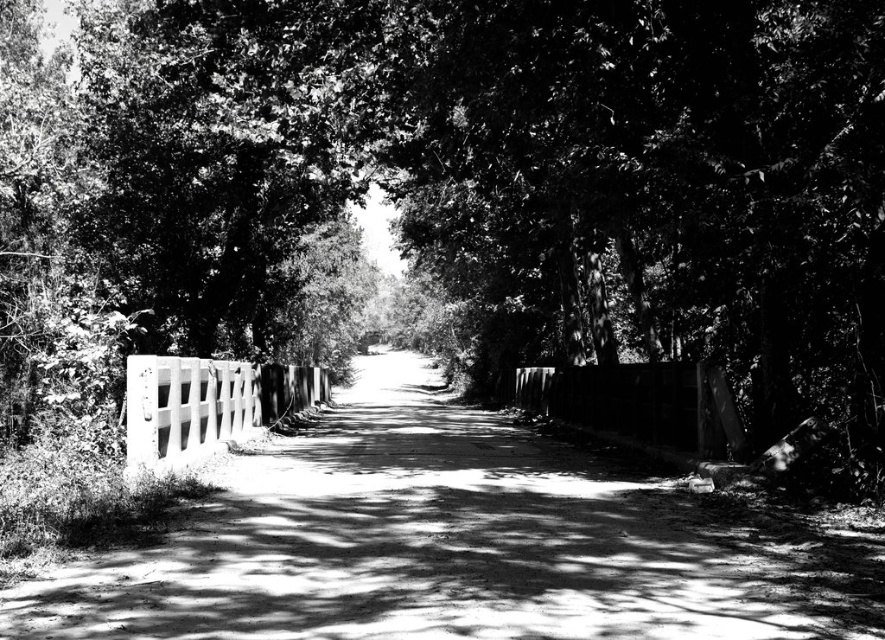
Does smooth concrete fence at left have a lesser width compared to smooth wooden fence at center?

No, smooth concrete fence at left is not thinner than smooth wooden fence at center.

Does smooth concrete fence at left appear on the left side of smooth wooden fence at center?

Indeed, smooth concrete fence at left is positioned on the left side of smooth wooden fence at center.

Image resolution: width=885 pixels, height=640 pixels. Describe the element at coordinates (206, 404) in the screenshot. I see `smooth concrete fence at left` at that location.

The image size is (885, 640). Identify the location of smooth concrete fence at left. (206, 404).

Which is in front, point (37, 595) or point (608, 426)?

Positioned in front is point (37, 595).

Can you confirm if white wooden fence at left is wider than smooth wooden fence at center?

Yes, white wooden fence at left is wider than smooth wooden fence at center.

Where is `white wooden fence at left`? white wooden fence at left is located at coordinates (455, 545).

Does white wooden fence at left appear under smooth concrete fence at left?

Indeed, white wooden fence at left is positioned under smooth concrete fence at left.

Who is taller, white wooden fence at left or smooth concrete fence at left?

smooth concrete fence at left is taller.

Does point (458, 612) come farther from viewer compared to point (310, 384)?

No.

Where is `white wooden fence at left`? The width and height of the screenshot is (885, 640). white wooden fence at left is located at coordinates pyautogui.click(x=455, y=545).